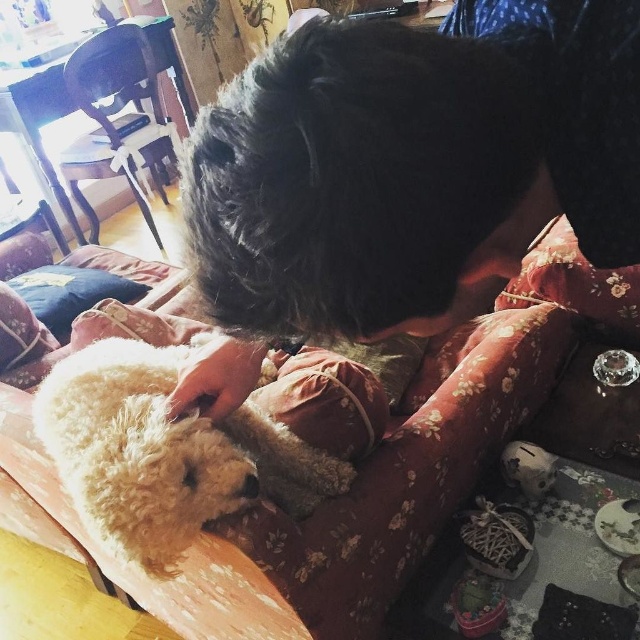
Question: Is black fluffy dog at upper center to the right of fluffy fabric pillow at lower left from the viewer's perspective?

Choices:
 (A) no
 (B) yes

Answer: (B)

Question: Which is farther from the black fluffy dog at upper center?

Choices:
 (A) fluffy fabric pillow at lower left
 (B) white fluffy dog at center

Answer: (A)

Question: Which of the following is the closest to the observer?

Choices:
 (A) (173, 432)
 (B) (470, 129)
 (C) (61, 321)
 (D) (506, 410)

Answer: (B)

Question: In this image, where is white fluffy dog at center located relative to fluffy fabric pillow at lower left?

Choices:
 (A) above
 (B) below

Answer: (B)

Question: Which point appears farthest from the camera in this image?

Choices:
 (A) (292, 593)
 (B) (173, 436)
 (C) (35, 305)

Answer: (C)

Question: Does black fluffy dog at upper center have a lesser width compared to fluffy fabric pillow at lower left?

Choices:
 (A) no
 (B) yes

Answer: (B)